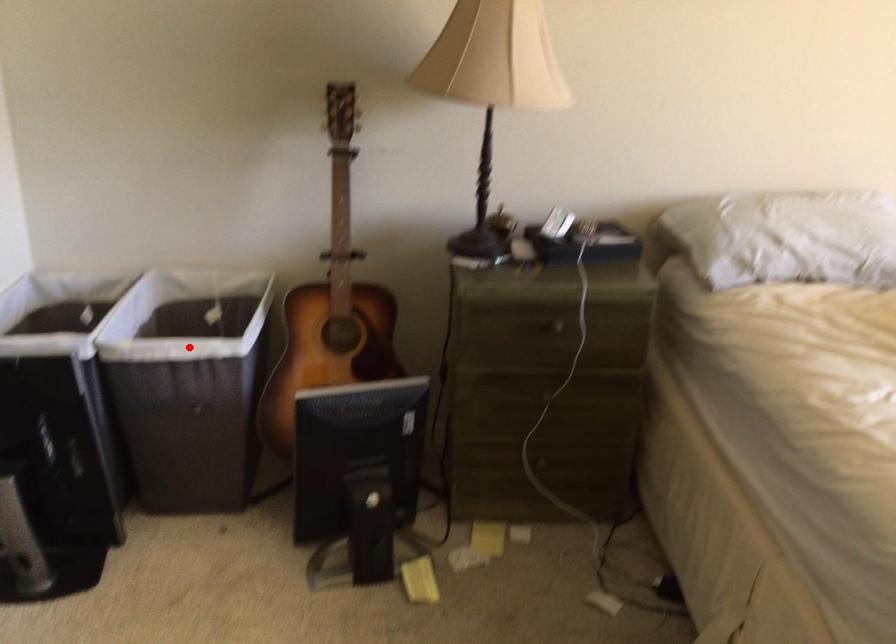
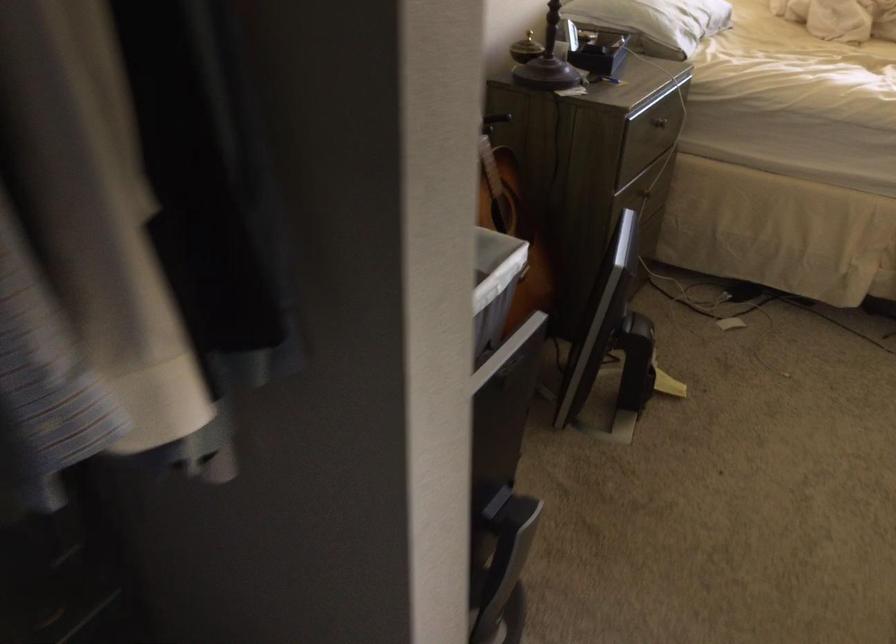
Locate, in the second image, the point that corresponds to the highlighted location in the first image.

(494, 286)